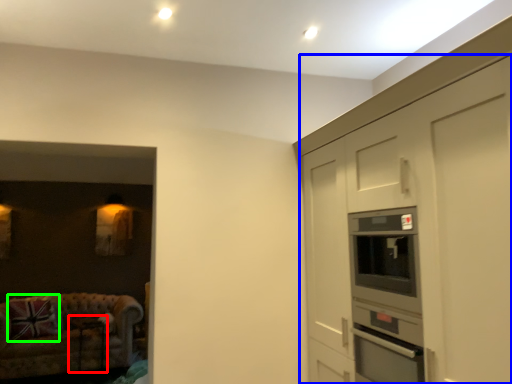
Question: Which is nearer to the table (highlighted by a red box)? cabinetry (highlighted by a blue box) or pillow (highlighted by a green box).

Choices:
 (A) cabinetry
 (B) pillow

Answer: (B)